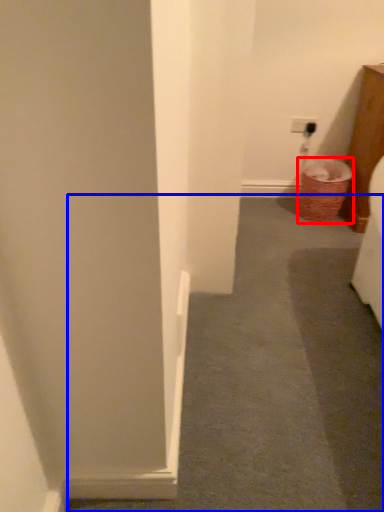
Question: Which point is closer to the camera, laundry basket (highlighted by a red box) or path (highlighted by a blue box)?

Choices:
 (A) laundry basket
 (B) path

Answer: (B)